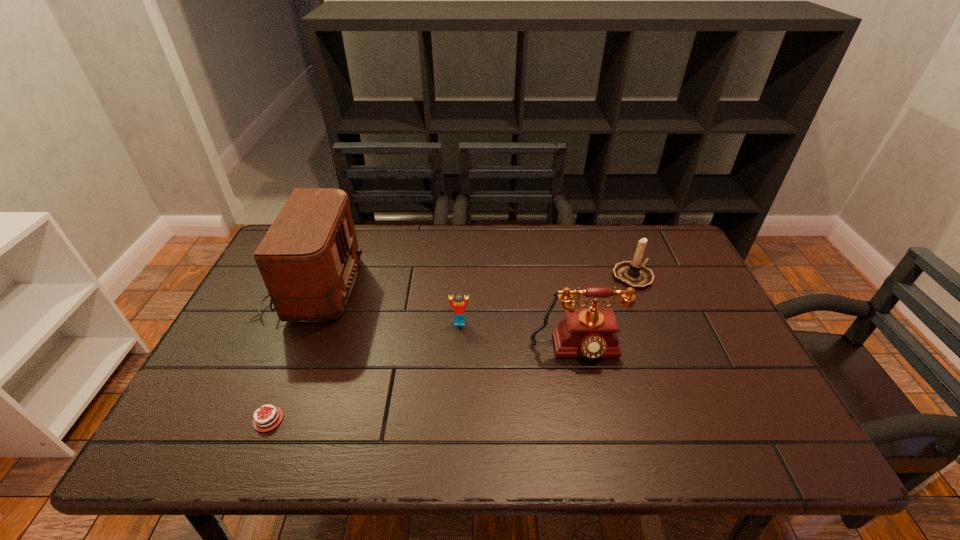
Where is `the tallest object`? This screenshot has height=540, width=960. the tallest object is located at coordinates (308, 259).

Image resolution: width=960 pixels, height=540 pixels. I want to click on the second object from right to left, so click(x=590, y=332).

Find the location of a particular element. This screenshot has width=960, height=540. the second tallest object is located at coordinates (590, 332).

Identify the location of the rightmost object. This screenshot has width=960, height=540. (634, 274).

This screenshot has height=540, width=960. I want to click on candle holder, so click(634, 274).

What are the coordinates of `Lego` in the screenshot? It's located at (459, 306).

Where is `the second shortest object`? Image resolution: width=960 pixels, height=540 pixels. the second shortest object is located at coordinates (459, 306).

Identify the location of the shortest object. The width and height of the screenshot is (960, 540). (271, 416).

Locate an element on the screen. This screenshot has width=960, height=540. chocolate cake is located at coordinates (271, 416).

You are a GUI agent. You are given a task and a screenshot of the screen. Output one action in this format:
    pyautogui.click(x=<x>, y=<y>)
    Task: Click on the vacant area situated on the front panel of the radio receiver
    The image size is (960, 540).
    Given the screenshot: What is the action you would take?
    pyautogui.click(x=441, y=287)